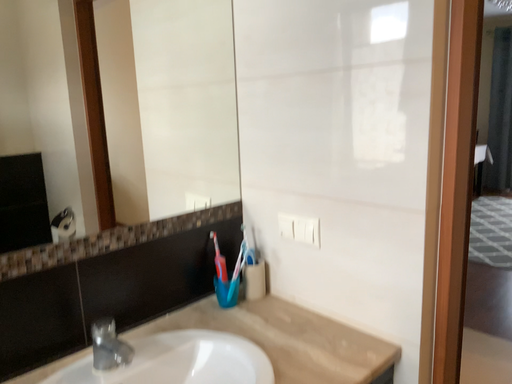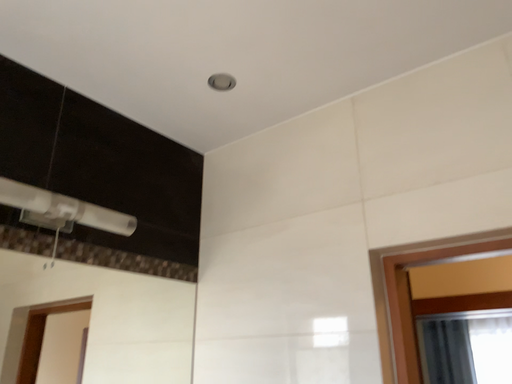
Question: Which way did the camera rotate in the video?

Choices:
 (A) rotated upward
 (B) rotated downward

Answer: (A)